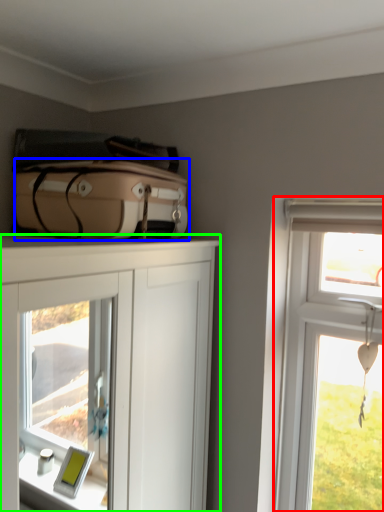
Question: Based on their relative distances, which object is nearer to window (highlighted by a red box)? Choose from suitcase (highlighted by a blue box) and cabinetry (highlighted by a green box).

Choices:
 (A) suitcase
 (B) cabinetry

Answer: (A)